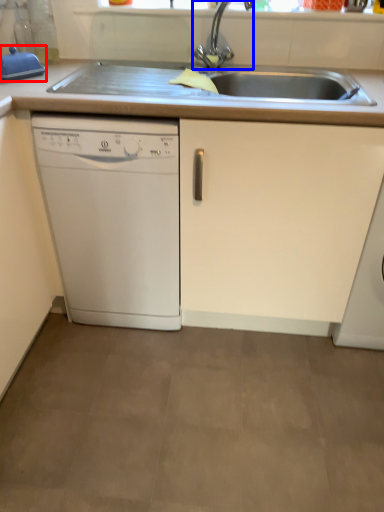
Question: Which point is further to the camera, appliance (highlighted by a red box) or tap (highlighted by a blue box)?

Choices:
 (A) appliance
 (B) tap

Answer: (A)